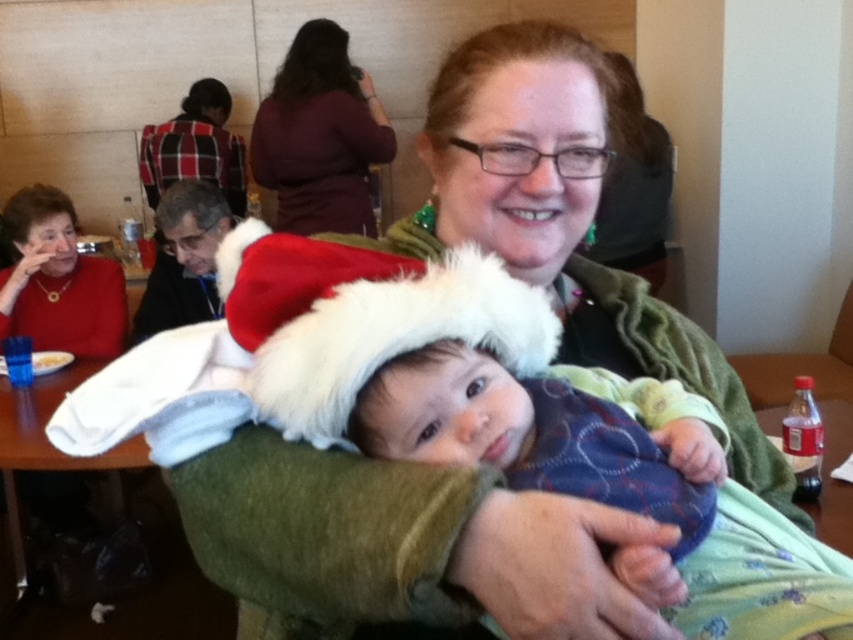
You are a photographer setting up for a group photo. You notice the white fluffy santa hat at center and the matte red sweater at left in your frame. Which object should you adjust to ensure both are fully visible in the photo?

The white fluffy santa hat at center is shorter than the matte red sweater at left. To ensure both are fully visible, you should lower the camera angle slightly so that the taller matte red sweater at left doesn

You are organizing a small event and need to place a 2.5 meter long banner between the maroon sweater at upper center and the wooden table at lower left. Can the banner fit horizontally between them?

The maroon sweater at upper center has a lesser width compared to wooden table at lower left, so the banner cannot fit horizontally between them because the total available space is less than 2.5 meters.

You are standing in the dining area and want to place a 25 inch long decoration on the table. Is there enough space between the edge of the table and the point at coordinates point [485,300] to place it?

The distance of point [485,300] from camera is 24.75 inches, so the space is insufficient to place the 25 inch long decoration as it is slightly shorter than required.